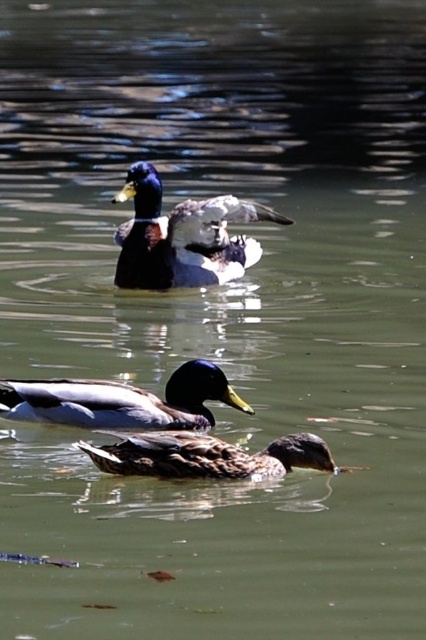
You are standing on the lakeside and see the shiny brown duck at center and the brown matte duck at lower center. Which duck is closer to you?

The shiny brown duck at center is closer to you because it is located above the brown matte duck at lower center, indicating it is nearer in the visual plane.

You are observing the ducks in the water. Which duck is located to the right of the other between the shiny green drake at upper center and the shiny brown duck at center?

The shiny green drake at upper center is positioned on the right side of the shiny brown duck at center.

You are standing at the center of the image and want to locate the shiny green drake at upper center. According to the coordinates provided, in which direction should you look relative to your current position?

The shiny green drake at upper center is located at coordinates point (183, 236). Since the center of the image is at (213, 320), you should look slightly to the left and down to find it.